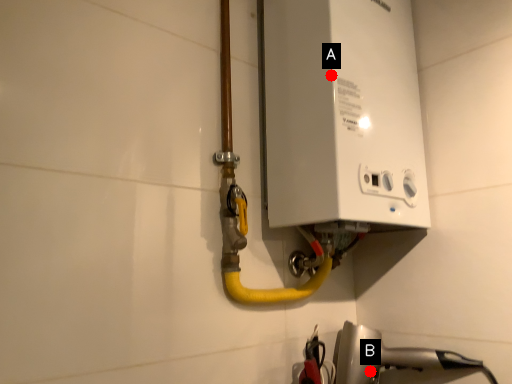
Question: Two points are circled on the image, labeled by A and B beside each circle. Which point is closer to the camera?

Choices:
 (A) A is closer
 (B) B is closer

Answer: (A)